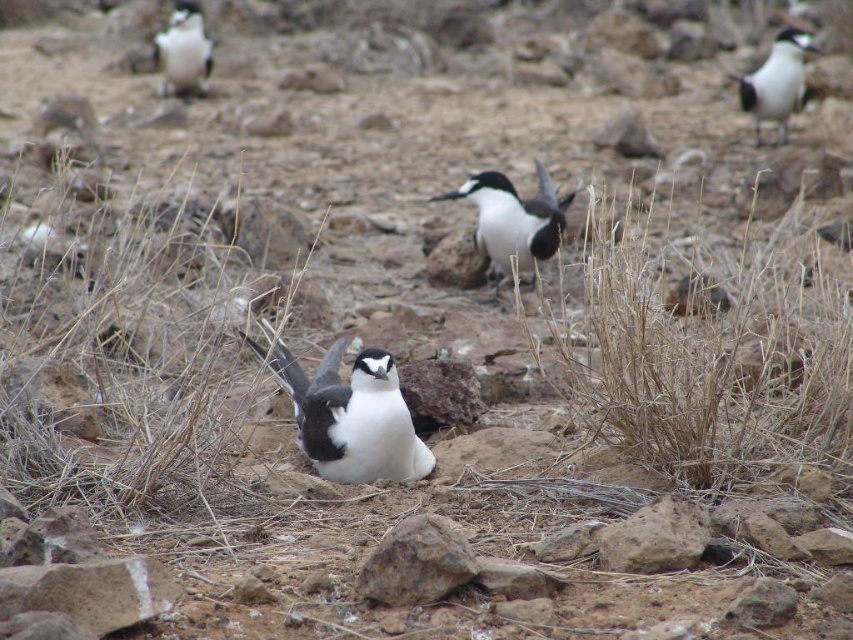
You are a wildlife photographer positioned at the center of the scene. You want to capture both white glossy penguin at upper right and white glossy penguin at upper left in a single frame. Which penguin should you pan your camera towards first to ensure both are in the shot?

You should pan your camera towards the white glossy penguin at upper left first because it is positioned to the left of the white glossy penguin at upper right. By starting with the left penguin, you can adjust your camera to include both in the frame since the right penguin is to the right of the left one.

You are a wildlife photographer standing at the camera position in this coastal scene. You want to capture a closeup shot of the white glossy penguin at upper right. Given that your telephoto lens has a minimum focusing distance of 10 meters, will you be able to take the photo without moving closer?

The distance between the white glossy penguin at upper right and the camera is 8.66 meters, which is less than the telephoto lens minimum focusing distance of 10 meters. Therefore, you cannot take the closeup shot without moving closer.